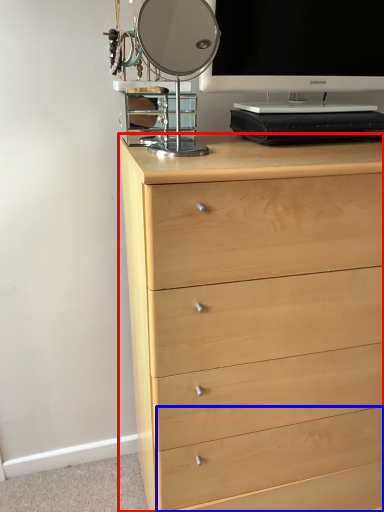
Question: Which of the following is the closest to the observer, chest of drawers (highlighted by a red box) or drawer (highlighted by a blue box)?

Choices:
 (A) chest of drawers
 (B) drawer

Answer: (A)